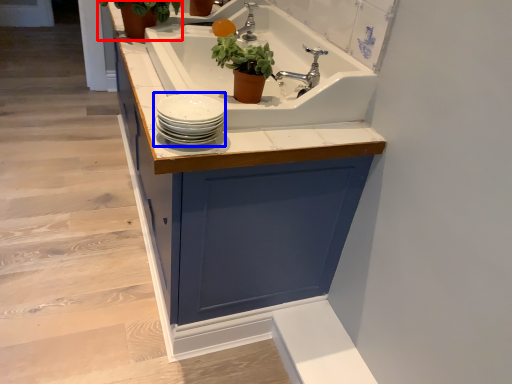
Question: Which point is closer to the camera, houseplant (highlighted by a red box) or tableware (highlighted by a blue box)?

Choices:
 (A) houseplant
 (B) tableware

Answer: (B)